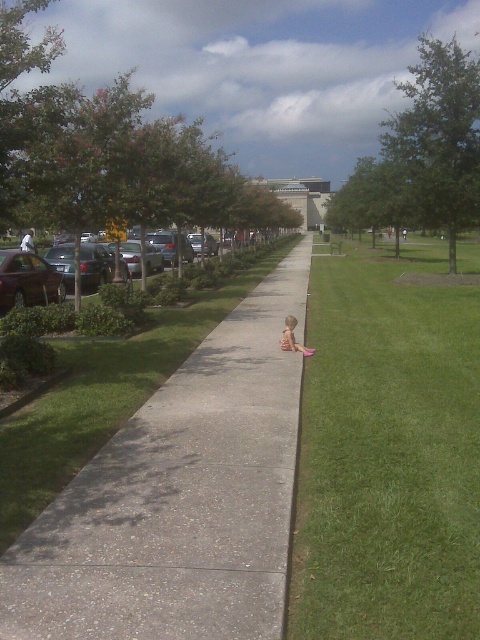
You are standing at the edge of the grass where the small child is sitting. You want to walk to the concrete at center. Which direction should you move relative to the light brown wooden chair at center?

The concrete at center is to the right of the light brown wooden chair at center, so you should move to the right of the light brown wooden chair at center to reach the concrete at center.

You are standing at the front of the gray concrete sidewalk at center and want to reach the light brown wooden chair at center. Which direction should you move to get closer to the chair?

You should move forward because the gray concrete sidewalk at center is closer to the viewer than the light brown wooden chair at center, so moving forward along the sidewalk will bring you closer to the chair.